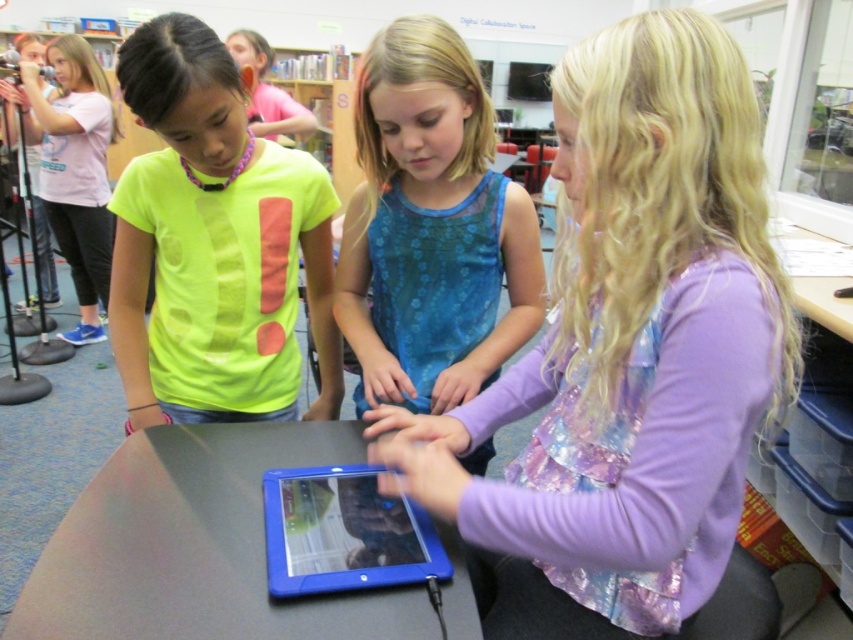
Question: Which point is closer to the camera?

Choices:
 (A) matte pink shirt at upper center
 (B) neon yellow t-shirt at center
 (C) blue sheer dress at center
 (D) pink t-shirt at upper left

Answer: (B)

Question: Which object is the closest to the pink t-shirt at upper left?

Choices:
 (A) blue sheer dress at center
 (B) neon yellow t-shirt at center

Answer: (B)

Question: Is neon yellow t-shirt at center thinner than smooth gray table at center?

Choices:
 (A) yes
 (B) no

Answer: (A)

Question: Considering the relative positions of blue sheer dress at center and matte pink shirt at upper center in the image provided, where is blue sheer dress at center located with respect to matte pink shirt at upper center?

Choices:
 (A) left
 (B) right

Answer: (B)

Question: Does shiny purple shirt at center lie behind blue sheer dress at center?

Choices:
 (A) yes
 (B) no

Answer: (B)

Question: Which point is closer to the camera?

Choices:
 (A) (260, 81)
 (B) (270, 586)
 (C) (186, 486)

Answer: (B)